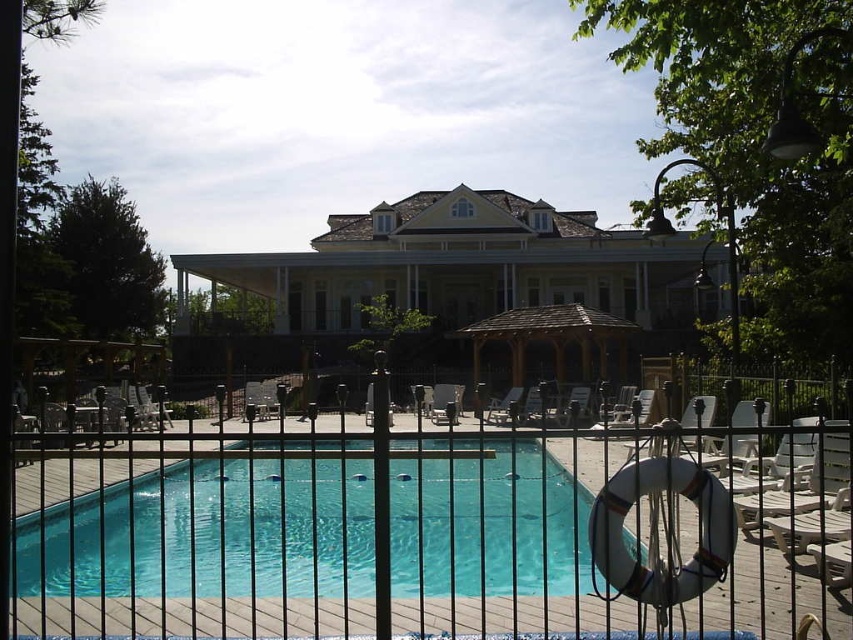
Which is more to the right, black metal fence at center or wooden lounge chair at center?

From the viewer's perspective, wooden lounge chair at center appears more on the right side.

Is point (253, 554) farther from viewer compared to point (450, 384)?

No.

Which is in front, point (782, 515) or point (434, 417)?

Positioned in front is point (782, 515).

Image resolution: width=853 pixels, height=640 pixels. I want to click on black metal fence at center, so click(428, 529).

Is point (550, 314) less distant than point (448, 404)?

No.

Which of these two, brown wooden gazebo at center or wooden lounge chair at center, stands shorter?

Standing shorter between the two is wooden lounge chair at center.

Who is more distant from viewer, (584, 333) or (430, 413)?

The point (584, 333) is behind.

Locate an element on the screen. This screenshot has width=853, height=640. brown wooden gazebo at center is located at coordinates (548, 337).

Who is lower down, black metal fence at center or clear glass pool at center?

clear glass pool at center is lower down.

The image size is (853, 640). Find the location of `black metal fence at center`. black metal fence at center is located at coordinates (428, 529).

Which is behind, point (175, 544) or point (93, 564)?

The point (175, 544) is more distant.

Find the location of a particular element. black metal fence at center is located at coordinates (428, 529).